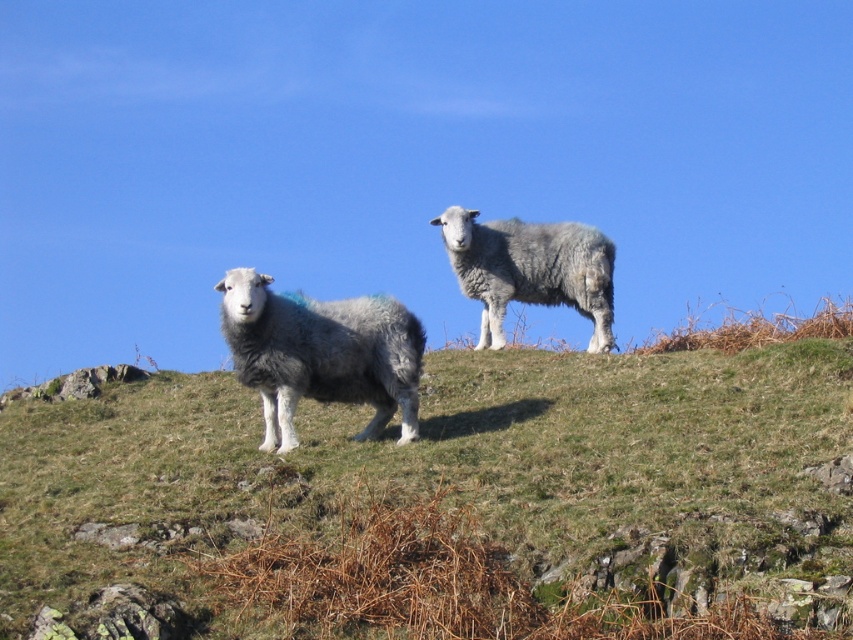
You are standing at the camera position and want to reach the point marked as point (763, 502). If your walking speed is 3 feet per second, how many seconds will it take you to reach there?

The distance of point (763, 502) from camera is 32.03 feet. At a speed of 3 feet per second, it will take approximately 10.68 seconds to reach there.

You are a farmer checking the size of your sheep. You have two sheep in front of you, the fuzzy gray sheep at center and the gray woolly sheep at center. Which sheep is wider?

The fuzzy gray sheep at center is less wide than the gray woolly sheep at center, so the gray woolly sheep at center is wider.